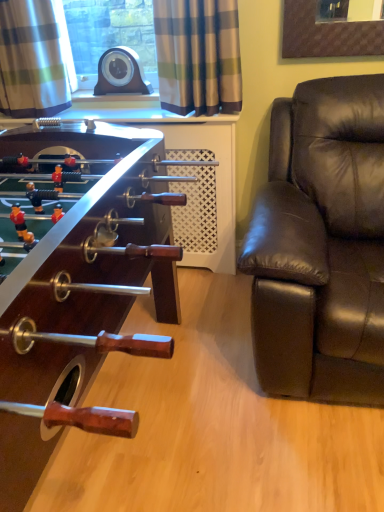
Question: Considering the positions of point (364, 209) and point (195, 9), is point (364, 209) closer or farther from the camera than point (195, 9)?

Choices:
 (A) closer
 (B) farther

Answer: (A)

Question: In terms of height, does brown leather couch at right look taller or shorter compared to plaid fabric curtain at upper center, marked as the 2th curtain in a left-to-right arrangement?

Choices:
 (A) tall
 (B) short

Answer: (A)

Question: Which object is the farthest from the plaid fabric curtain at upper center, marked as the 2th curtain in a left-to-right arrangement?

Choices:
 (A) brown leather couch at right
 (B) plaid fabric curtain at upper left, placed as the 1th curtain when sorted from left to right
 (C) wooden foosball table at left

Answer: (C)

Question: Based on their relative distances, which object is nearer to the plaid fabric curtain at upper left, placed as the 1th curtain when sorted from left to right?

Choices:
 (A) wooden foosball table at left
 (B) plaid fabric curtain at upper center, marked as the 2th curtain in a left-to-right arrangement
 (C) brown leather couch at right

Answer: (B)